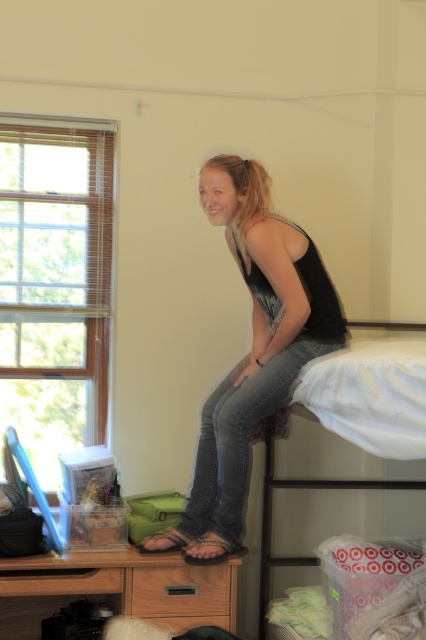
Can you confirm if black matte tank top at upper center is positioned below white fabric bunk bed at upper right?

No, black matte tank top at upper center is not below white fabric bunk bed at upper right.

Which is behind, point (250, 388) or point (268, 544)?

Positioned behind is point (268, 544).

Locate an element on the screen. black matte tank top at upper center is located at coordinates (252, 349).